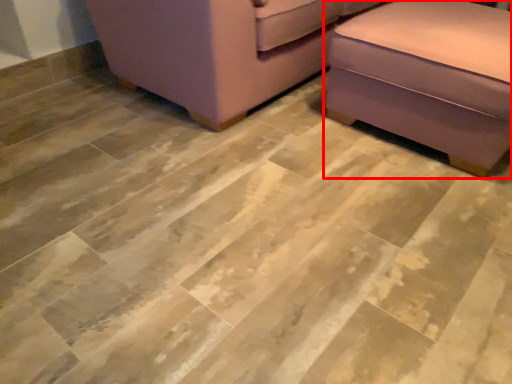
Question: From the image, what is the correct spatial relationship of furniture (annotated by the red box) in relation to furniture?

Choices:
 (A) right
 (B) left

Answer: (A)